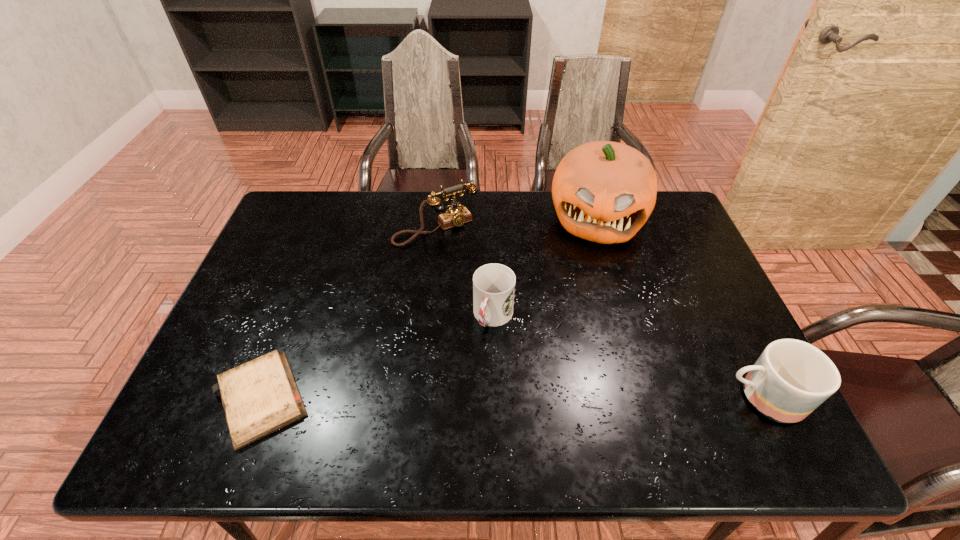
Where is `blank space located 0.310m on the side with the handle of the mug`? The width and height of the screenshot is (960, 540). blank space located 0.310m on the side with the handle of the mug is located at coordinates (584, 397).

The width and height of the screenshot is (960, 540). I want to click on vacant space situated on the front-facing side of the telephone, so pyautogui.click(x=498, y=304).

Where is `vacant space located 0.060m on the front-facing side of the telephone`? The image size is (960, 540). vacant space located 0.060m on the front-facing side of the telephone is located at coordinates (464, 257).

Locate an element on the screen. Image resolution: width=960 pixels, height=540 pixels. free space located 0.390m on the front-facing side of the telephone is located at coordinates (521, 336).

Where is `free space located 0.090m on the handle side of the third farthest object`? The image size is (960, 540). free space located 0.090m on the handle side of the third farthest object is located at coordinates (474, 367).

Image resolution: width=960 pixels, height=540 pixels. I want to click on vacant region located on the handle side of the third farthest object, so click(457, 407).

In order to click on free region located 0.160m on the handle side of the third farthest object in this screenshot , I will do `click(464, 392)`.

Where is `blank space located on the face of the second object from right to left`? The width and height of the screenshot is (960, 540). blank space located on the face of the second object from right to left is located at coordinates (583, 354).

At what (x,y) coordinates should I click in order to perform the action: click on vacant space located on the face of the second object from right to left. Please return your answer as a coordinate pair (x, y). This screenshot has height=540, width=960. Looking at the image, I should click on (588, 295).

In order to click on vacant position located on the face of the second object from right to left in this screenshot , I will do `click(590, 277)`.